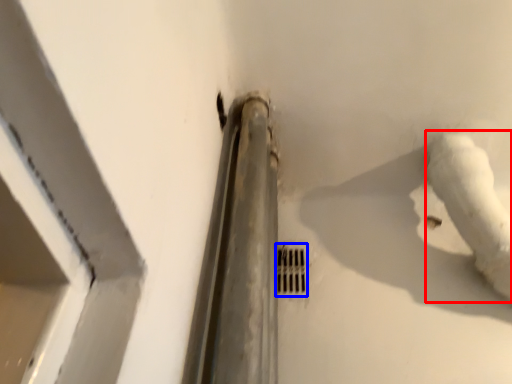
Question: Which object appears closest to the camera in this image, water pipe (highlighted by a red box) or hole (highlighted by a blue box)?

Choices:
 (A) water pipe
 (B) hole

Answer: (A)